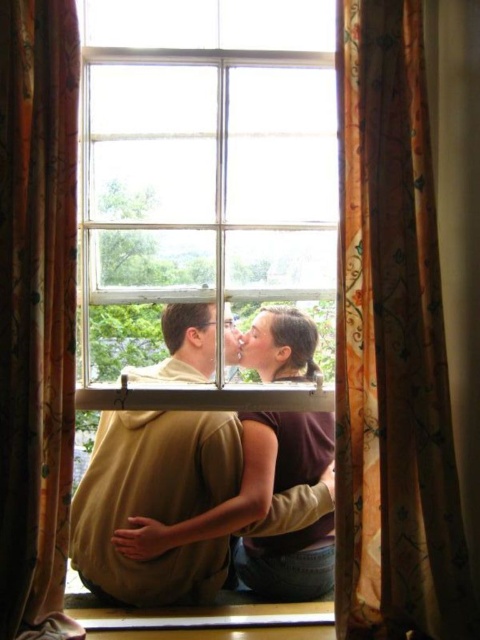
Question: In this image, where is clear glass window at center located relative to floral patterned fabric curtain at center?

Choices:
 (A) below
 (B) above

Answer: (B)

Question: Which point is closer to the camera?

Choices:
 (A) brown fabric hair at center
 (B) floral patterned fabric curtain at center

Answer: (B)

Question: Which point is farther to the camera?

Choices:
 (A) floral silk curtain at right
 (B) floral patterned fabric curtain at center

Answer: (A)

Question: Is clear glass window at center positioned in front of brown fabric hair at center?

Choices:
 (A) no
 (B) yes

Answer: (B)

Question: Based on their relative distances, which object is farther from the wooden at lower center?

Choices:
 (A) brown fabric hair at center
 (B) clear glass window at center
 (C) matte khaki hoodie at center

Answer: (B)

Question: Is clear glass window at center smaller than wooden at lower center?

Choices:
 (A) no
 (B) yes

Answer: (A)